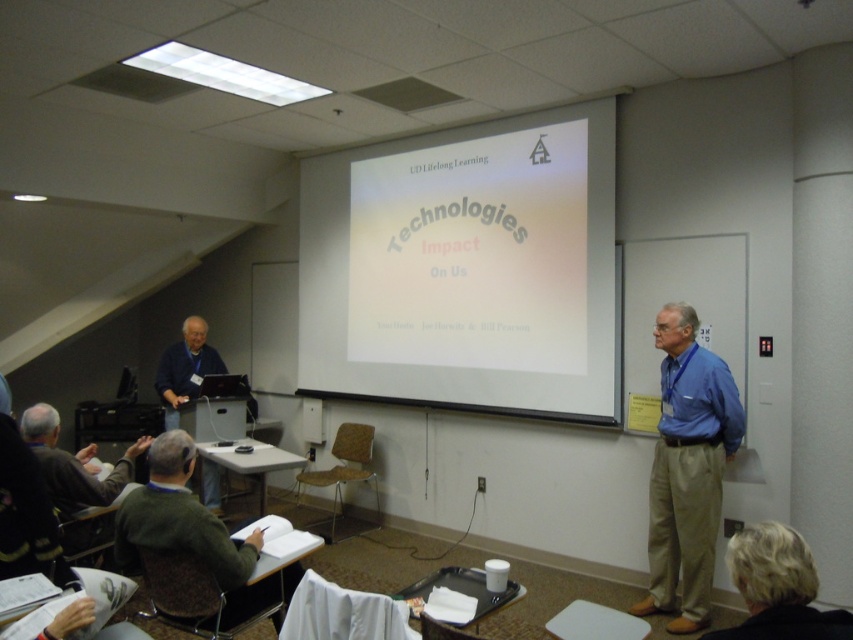
Who is taller, blue cotton shirt at right or blonde hair at lower right?

With more height is blue cotton shirt at right.

Is blue cotton shirt at right closer to camera compared to blonde hair at lower right?

That is False.

This screenshot has width=853, height=640. Identify the location of blue cotton shirt at right. (688, 468).

Identify the location of blue cotton shirt at right. (688, 468).

Does point (675, 544) come closer to viewer compared to point (195, 353)?

That is True.

Is blue cotton shirt at right below matte blue shirt at left?

Yes, blue cotton shirt at right is below matte blue shirt at left.

Where is `blue cotton shirt at right`? This screenshot has height=640, width=853. blue cotton shirt at right is located at coordinates (688, 468).

Consider the image. Can you confirm if blue cotton shirt at right is positioned below green fabric chair at lower left?

Actually, blue cotton shirt at right is above green fabric chair at lower left.

Does point (714, 442) come behind point (129, 570)?

Yes, point (714, 442) is behind point (129, 570).

At what (x,y) coordinates should I click in order to perform the action: click on blue cotton shirt at right. Please return your answer as a coordinate pair (x, y). This screenshot has height=640, width=853. Looking at the image, I should click on (688, 468).